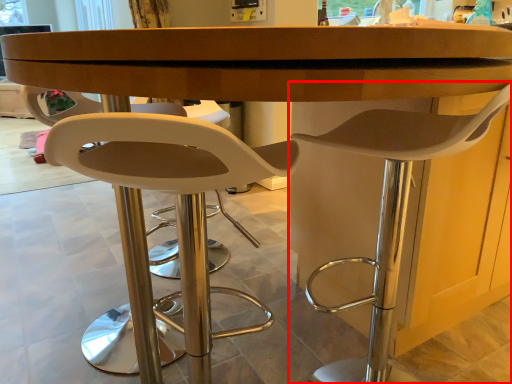
Question: From the image's perspective, what is the correct spatial positioning of chair (annotated by the red box) in reference to chair?

Choices:
 (A) above
 (B) below

Answer: (A)